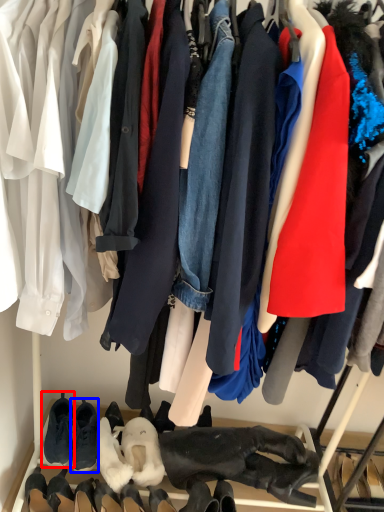
Question: Which object appears closest to the camera in this image, footwear (highlighted by a red box) or footwear (highlighted by a blue box)?

Choices:
 (A) footwear
 (B) footwear

Answer: (B)